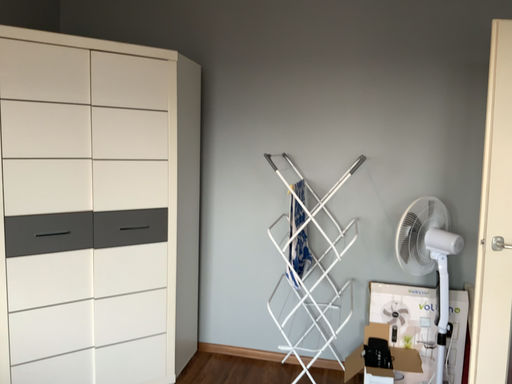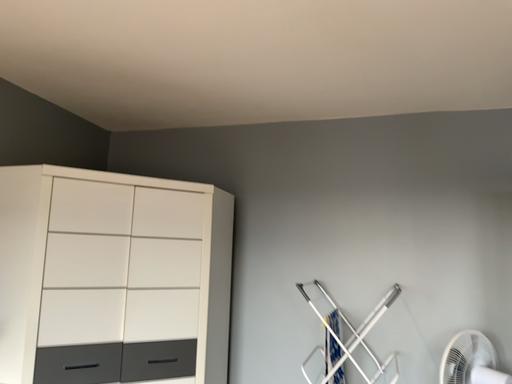
Question: Which way did the camera rotate in the video?

Choices:
 (A) rotated upward
 (B) rotated downward

Answer: (A)